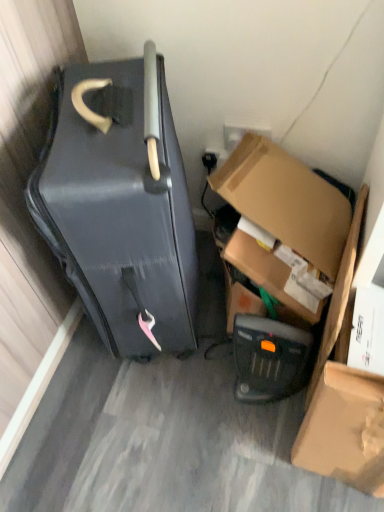
Question: Can you confirm if cardboard box at lower right is bigger than matte black suitcase at left?

Choices:
 (A) yes
 (B) no

Answer: (B)

Question: Is cardboard box at lower right to the left of matte black suitcase at left from the viewer's perspective?

Choices:
 (A) no
 (B) yes

Answer: (A)

Question: Does cardboard box at lower right have a lesser width compared to matte black suitcase at left?

Choices:
 (A) no
 (B) yes

Answer: (A)

Question: Can you confirm if cardboard box at lower right is shorter than matte black suitcase at left?

Choices:
 (A) no
 (B) yes

Answer: (B)

Question: From the image's perspective, is cardboard box at lower right beneath matte black suitcase at left?

Choices:
 (A) no
 (B) yes

Answer: (B)

Question: From the image's perspective, is cardboard box at lower right positioned above or below matte brown cardboard box at lower right?

Choices:
 (A) below
 (B) above

Answer: (B)

Question: Is cardboard box at lower right bigger or smaller than matte brown cardboard box at lower right?

Choices:
 (A) small
 (B) big

Answer: (B)

Question: Would you say cardboard box at lower right is inside or outside matte brown cardboard box at lower right?

Choices:
 (A) outside
 (B) inside

Answer: (A)

Question: In terms of height, does cardboard box at lower right look taller or shorter compared to matte brown cardboard box at lower right?

Choices:
 (A) short
 (B) tall

Answer: (A)

Question: Is matte brown cardboard box at lower right inside the boundaries of black plastic heater at lower center, or outside?

Choices:
 (A) outside
 (B) inside

Answer: (A)

Question: From the image's perspective, is matte brown cardboard box at lower right above or below black plastic heater at lower center?

Choices:
 (A) above
 (B) below

Answer: (B)

Question: From a real-world perspective, is matte brown cardboard box at lower right physically located above or below black plastic heater at lower center?

Choices:
 (A) above
 (B) below

Answer: (A)

Question: In terms of width, does matte brown cardboard box at lower right look wider or thinner when compared to black plastic heater at lower center?

Choices:
 (A) wide
 (B) thin

Answer: (B)

Question: In the image, is black plastic heater at lower center positioned in front of or behind matte black suitcase at left?

Choices:
 (A) front
 (B) behind

Answer: (B)

Question: Would you say black plastic heater at lower center is to the left or to the right of matte black suitcase at left in the picture?

Choices:
 (A) right
 (B) left

Answer: (A)